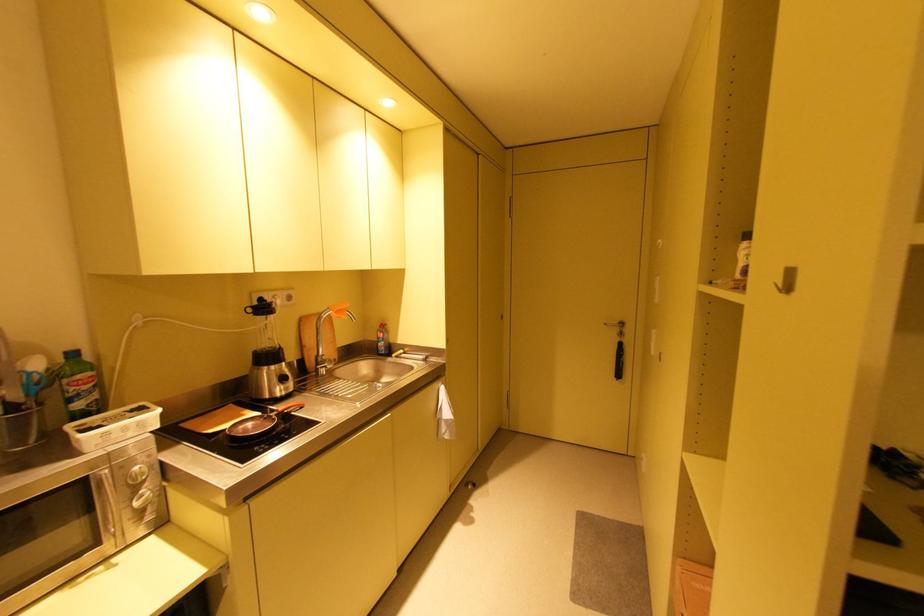
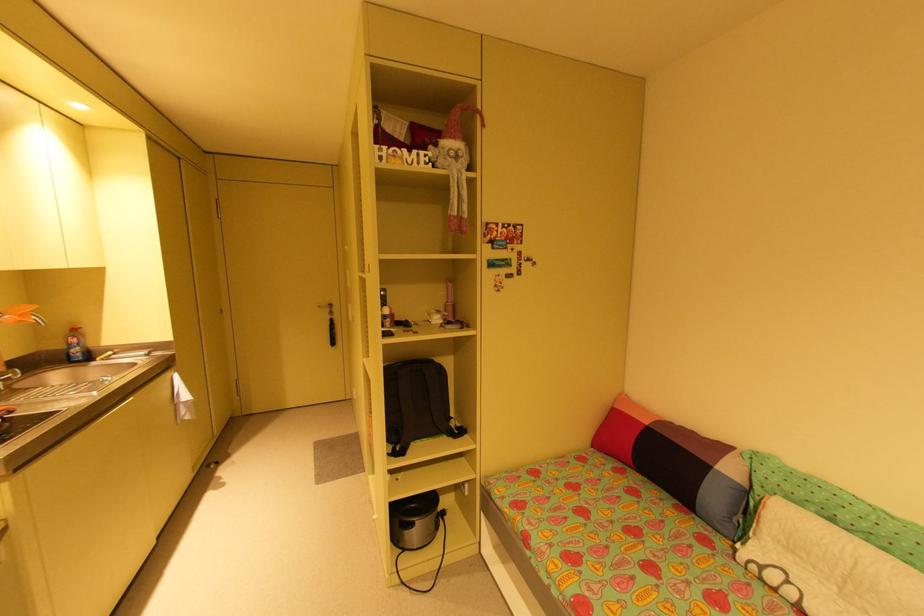
The point at (342, 312) is marked in the first image. Where is the corresponding point in the second image?

(25, 315)